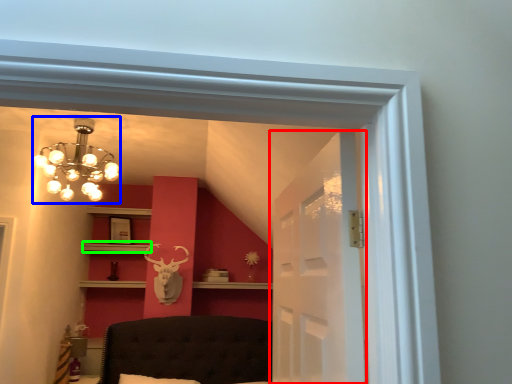
Question: Which is nearer to the glass door (highlighted by a red box)? lamp (highlighted by a blue box) or shelf (highlighted by a green box).

Choices:
 (A) lamp
 (B) shelf

Answer: (A)